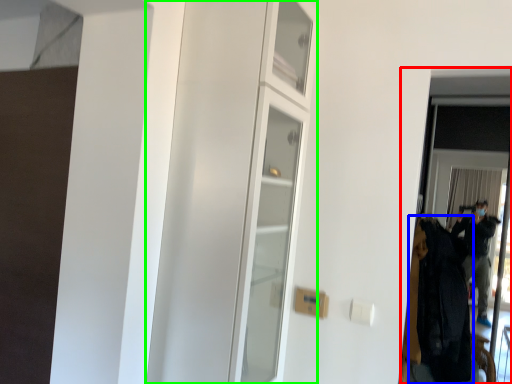
Question: Based on their relative distances, which object is farther from screen door (highlighted by a red box)? Choose from clothing (highlighted by a blue box) and dresser (highlighted by a green box).

Choices:
 (A) clothing
 (B) dresser

Answer: (B)